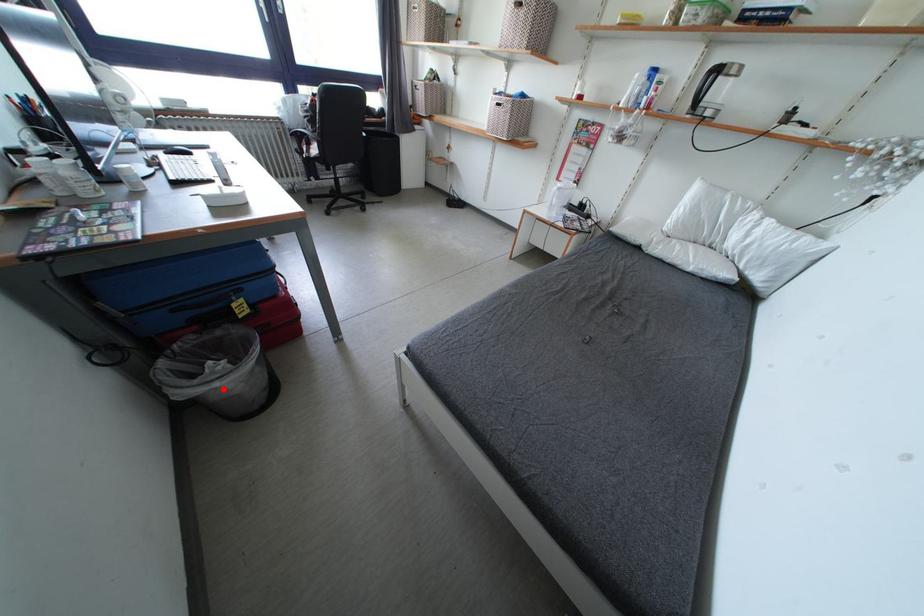
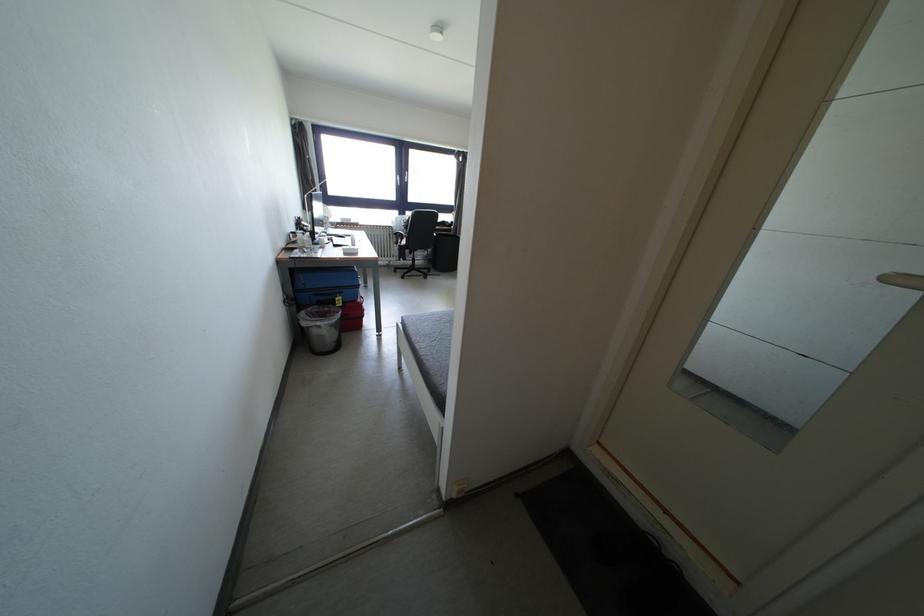
Question: A red point is marked in image1. In image2, is the corresponding 3D point closer to the camera or farther? Reply with the corresponding letter.

Choices:
 (A) The corresponding 3D point is closer.
 (B) The corresponding 3D point is farther.

Answer: (A)